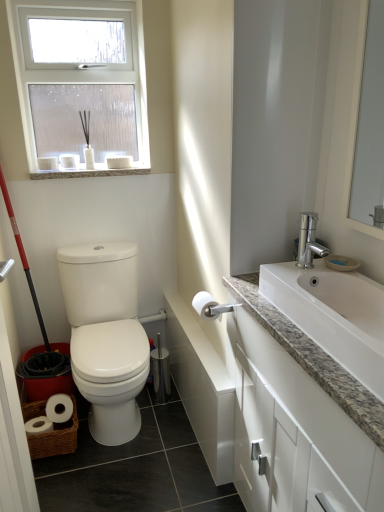
Question: Are white frosted glass window at upper left and red plastic screen door at left making contact?

Choices:
 (A) no
 (B) yes

Answer: (A)

Question: Would you say white frosted glass window at upper left contains red plastic screen door at left?

Choices:
 (A) no
 (B) yes

Answer: (A)

Question: Is white frosted glass window at upper left smaller than red plastic screen door at left?

Choices:
 (A) yes
 (B) no

Answer: (A)

Question: Is white frosted glass window at upper left oriented away from red plastic screen door at left?

Choices:
 (A) no
 (B) yes

Answer: (A)

Question: Can you confirm if white frosted glass window at upper left is positioned to the right of red plastic screen door at left?

Choices:
 (A) no
 (B) yes

Answer: (A)

Question: From a real-world perspective, is white frosted glass window at upper left on top of red plastic screen door at left?

Choices:
 (A) no
 (B) yes

Answer: (B)

Question: Can you confirm if white matte toilet paper at upper right is taller than woven brown basket at lower left?

Choices:
 (A) yes
 (B) no

Answer: (B)

Question: From the image's perspective, would you say white matte toilet paper at upper right is shown under woven brown basket at lower left?

Choices:
 (A) yes
 (B) no

Answer: (B)

Question: Does white matte toilet paper at upper right have a larger size compared to woven brown basket at lower left?

Choices:
 (A) no
 (B) yes

Answer: (A)

Question: Considering the relative sizes of white matte toilet paper at upper right and woven brown basket at lower left in the image provided, is white matte toilet paper at upper right thinner than woven brown basket at lower left?

Choices:
 (A) yes
 (B) no

Answer: (A)

Question: From a real-world perspective, does white matte toilet paper at upper right stand above woven brown basket at lower left?

Choices:
 (A) no
 (B) yes

Answer: (B)

Question: Is white matte toilet paper at upper right further to camera compared to woven brown basket at lower left?

Choices:
 (A) yes
 (B) no

Answer: (B)

Question: Is white glossy toilet paper at center not near red plastic screen door at left?

Choices:
 (A) yes
 (B) no

Answer: (B)